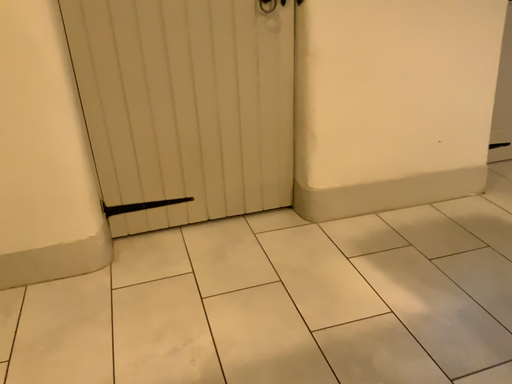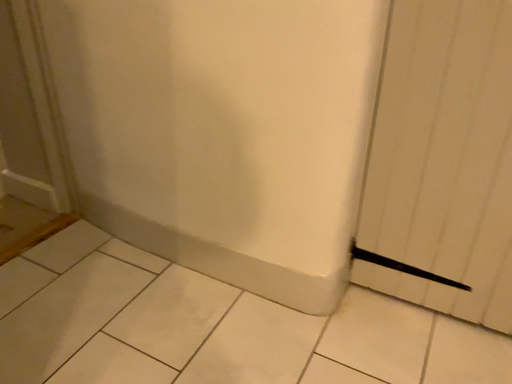
Question: Which way did the camera rotate in the video?

Choices:
 (A) rotated left
 (B) rotated right

Answer: (A)